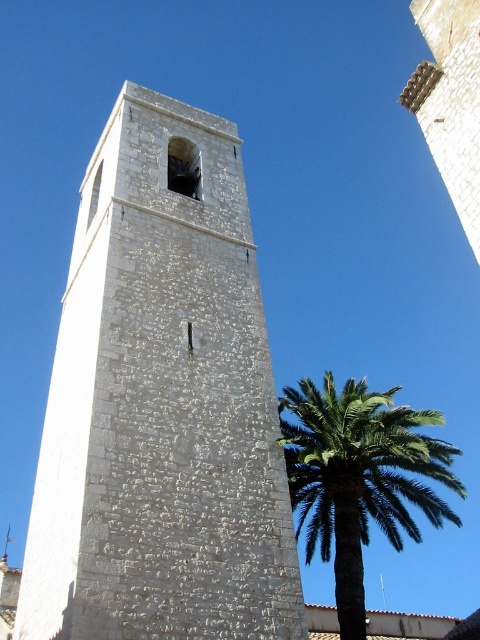
Question: Is white stone bell tower at center wider than green leafy palm at right?

Choices:
 (A) yes
 (B) no

Answer: (B)

Question: Can you confirm if white stone bell tower at center is bigger than green leafy palm at right?

Choices:
 (A) no
 (B) yes

Answer: (A)

Question: Is white stone bell tower at center to the left of green leafy palm at right from the viewer's perspective?

Choices:
 (A) no
 (B) yes

Answer: (B)